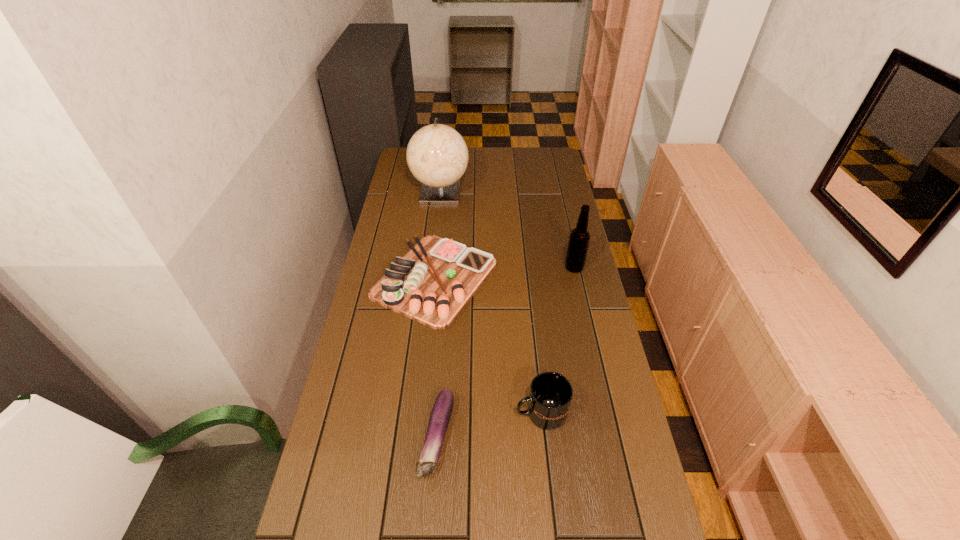
Where is `the second closest object to the shortest object`? The height and width of the screenshot is (540, 960). the second closest object to the shortest object is located at coordinates [431, 284].

Locate which object is the closest to the second object from right to left. Please provide its 2D coordinates. Your answer should be formatted as a tuple, i.e. [(x, y)], where the tuple contains the x and y coordinates of a point satisfying the conditions above.

[(441, 412)]

Find the location of a particular element. The image size is (960, 540). free space that satisfies the following two spatial constraints: 1. on the surface of the rightmost object showing Europe and Africa; 2. on the right side of the globe is located at coordinates (432, 267).

The image size is (960, 540). Find the location of `vacant space that satisfies the following two spatial constraints: 1. on the surface of the fourth shortest object showing Europe and Africa; 2. on the left side of the tallest object`. vacant space that satisfies the following two spatial constraints: 1. on the surface of the fourth shortest object showing Europe and Africa; 2. on the left side of the tallest object is located at coordinates (432, 267).

You are a GUI agent. You are given a task and a screenshot of the screen. Output one action in this format:
    pyautogui.click(x=<x>, y=<y>)
    Task: Click on the free point that satisfies the following two spatial constraints: 1. on the surface of the farthest object showing Europe and Africa; 2. on the left side of the platter
    The width and height of the screenshot is (960, 540).
    Given the screenshot: What is the action you would take?
    pyautogui.click(x=430, y=279)